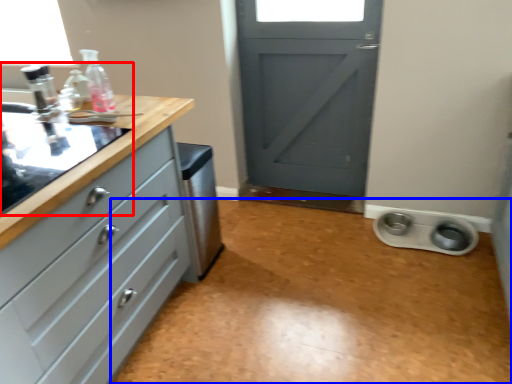
Question: Which point is closer to the camera, sink (highlighted by a red box) or plain (highlighted by a blue box)?

Choices:
 (A) sink
 (B) plain

Answer: (A)